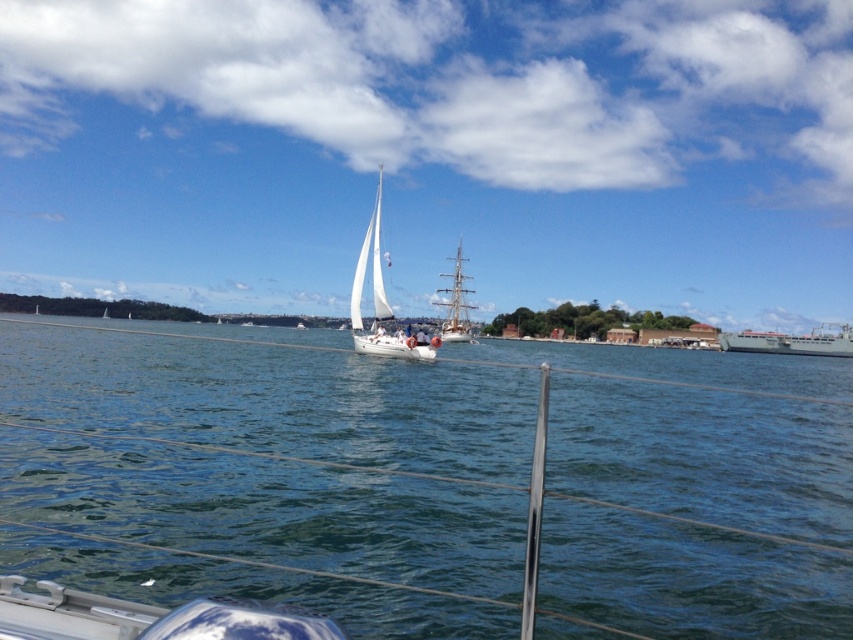
You are on a boat and see the white matte sailboat at center and the gray metallic ship at right. Which one is positioned more to the east if the sun is setting in the west?

The white matte sailboat at center is positioned more to the east since it is to the left of the gray metallic ship at right, and the sun setting in the west would mean east is to the left.

You are on a boat and looking at the scene. There are two sailboats in front of you, the white matte sailboat at center and the white wooden sailboat at center. Which one appears closer to you based on their positions?

The white matte sailboat at center appears closer because it is positioned above the white wooden sailboat at center, indicating it is nearer in the visual hierarchy.